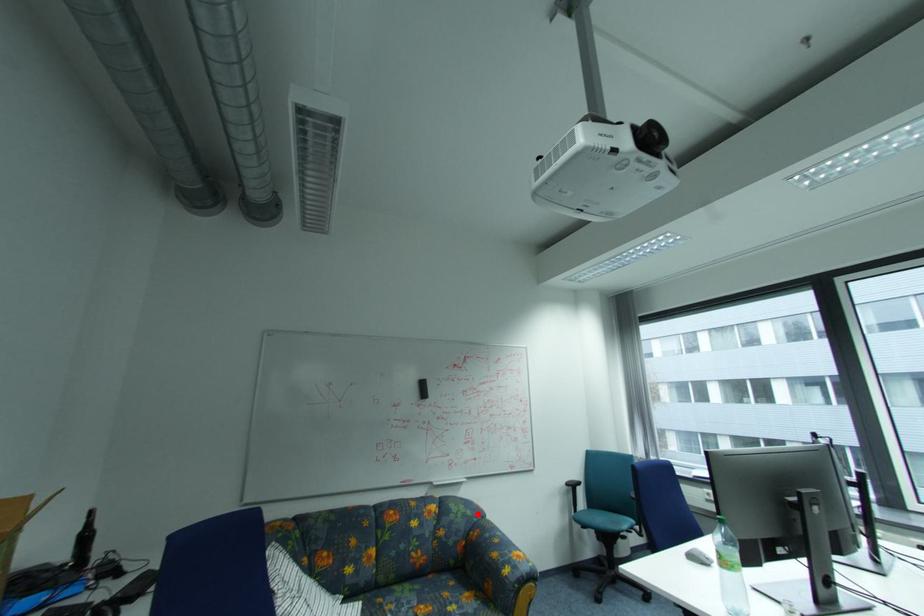
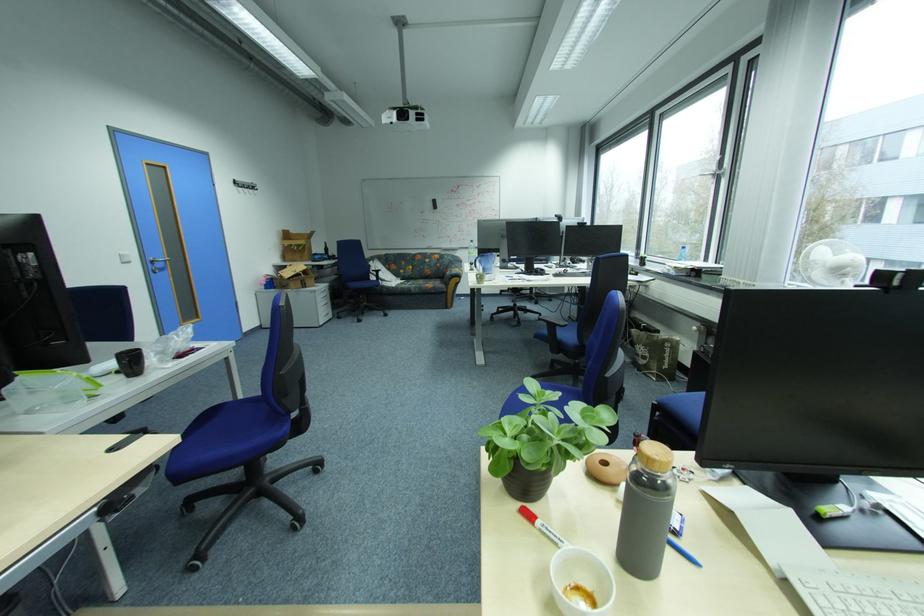
Question: I am providing you with two images of the same scene from different viewpoints. A red point is shown in image1. For the corresponding object point in image2, is it positioned nearer or farther from the camera?

Choices:
 (A) Nearer
 (B) Farther

Answer: (A)